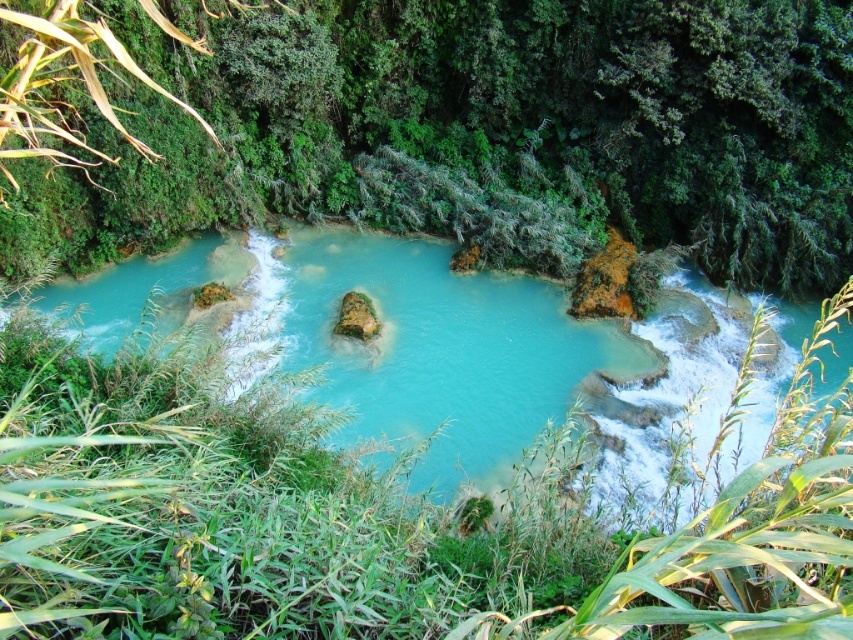
You are standing at the origin point of the coordinate system in this scene. Where is the green leafy vegetation at center located in terms of coordinates?

The green leafy vegetation at center is located at coordinates point [451,129].

You are a hiker who wants to take a photo of the turquoise glossy water at center. However, you notice that the green leafy vegetation at center is blocking your view. Can you determine if the vegetation is taller than the water surface?

The green leafy vegetation at center is much taller than the turquoise glossy water at center, so it is blocking the view of the water surface.

Based on the scene description, can you determine which object, the green leafy vegetation at center or the turquoise glossy water at center, occupies a larger area in the image?

The green leafy vegetation at center might be wider than the turquoise glossy water at center according to the description.